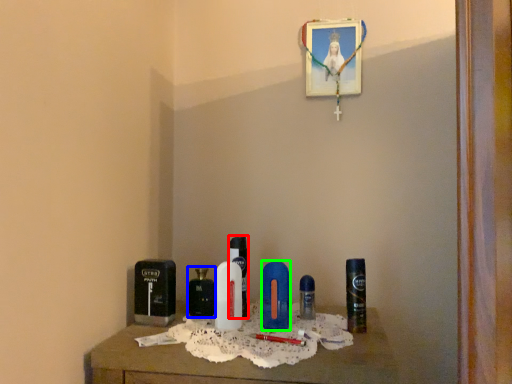
Question: Which object is positioned farthest from perfume (highlighted by a red box)? Select from perfume (highlighted by a blue box) and personal care (highlighted by a green box).

Choices:
 (A) perfume
 (B) personal care

Answer: (B)